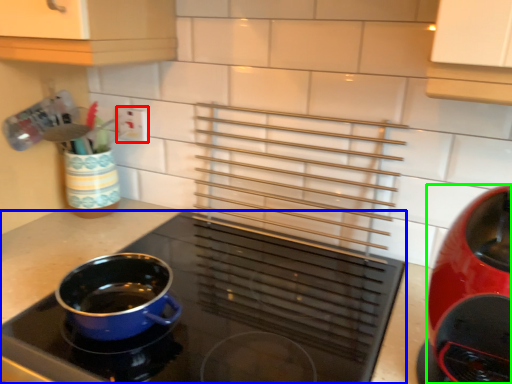
Question: Which is nearer to the electric outlet (highlighted by a red box)? kitchen appliance (highlighted by a blue box) or kitchen appliance (highlighted by a green box).

Choices:
 (A) kitchen appliance
 (B) kitchen appliance

Answer: (A)